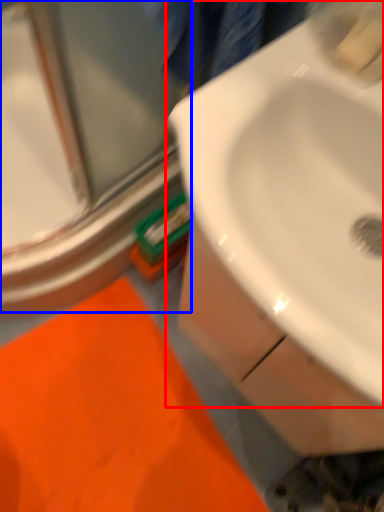
Question: Which object is further to the camera taking this photo, sink (highlighted by a red box) or glass door (highlighted by a blue box)?

Choices:
 (A) sink
 (B) glass door

Answer: (B)